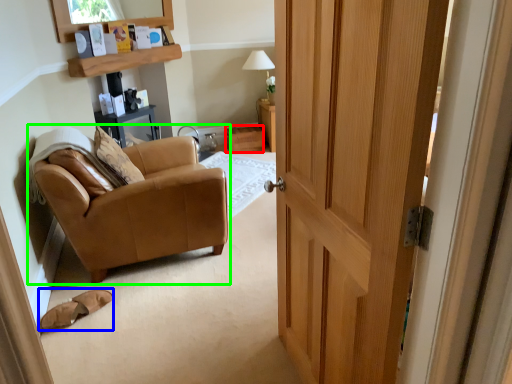
Question: Based on their relative distances, which object is farther from drawer (highlighted by a red box)? Choose from footwear (highlighted by a blue box) and chair (highlighted by a green box).

Choices:
 (A) footwear
 (B) chair

Answer: (A)